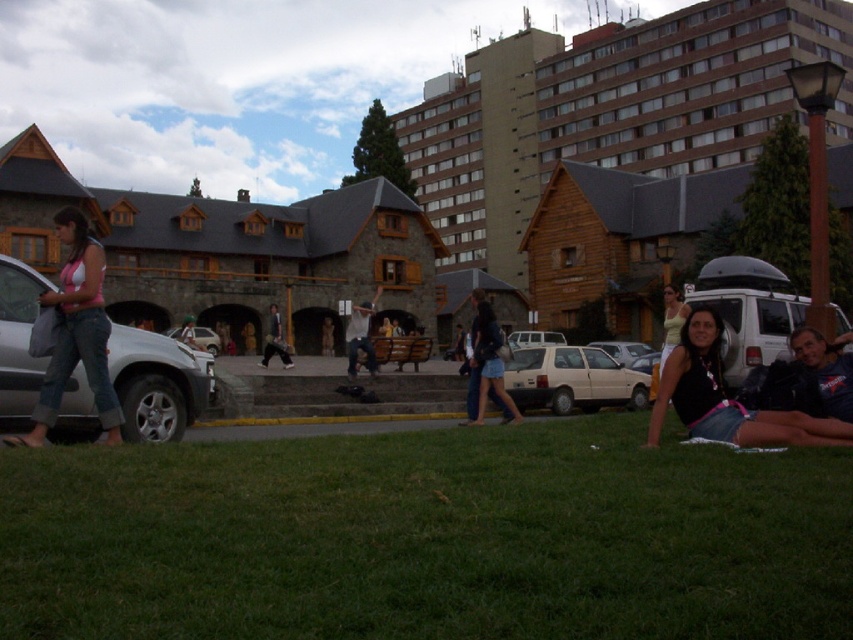
Is beige matte hatchback at center shorter than white cotton shirt at center?

Correct, beige matte hatchback at center is not as tall as white cotton shirt at center.

Is point (584, 358) positioned behind point (352, 369)?

No, (584, 358) is in front of (352, 369).

Is point (582, 406) less distant than point (349, 368)?

Yes.

This screenshot has height=640, width=853. I want to click on beige matte hatchback at center, so click(572, 380).

Does silver metallic suv at left have a larger size compared to white cotton shirt at center?

No, silver metallic suv at left is not bigger than white cotton shirt at center.

This screenshot has width=853, height=640. I want to click on silver metallic suv at left, so click(157, 384).

I want to click on silver metallic suv at left, so click(157, 384).

Is white cotton shirt at center wider than dark blue jeans at center?

Incorrect, white cotton shirt at center's width does not surpass dark blue jeans at center's.

Between point (374, 362) and point (271, 353), which one is positioned in front?

Point (374, 362) is more forward.

You are a GUI agent. You are given a task and a screenshot of the screen. Output one action in this format:
    pyautogui.click(x=<x>, y=<y>)
    Task: Click on the white cotton shirt at center
    
    Given the screenshot: What is the action you would take?
    pyautogui.click(x=360, y=337)